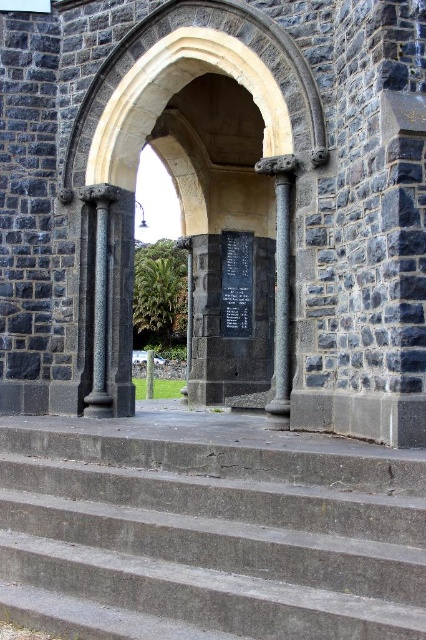
You are standing in front of the arched doorway and want to reach the black plaque mounted inside the archway. The gray concrete stairs at center are in your way. Can you move around them to access the plaque?

The gray concrete stairs at center are located at point [209,538], so you can move around them to access the plaque.

You are standing in front of the arched doorway and want to read the text on the black polished stone plaque at center. Which direction should you move to reach it from the gray concrete stairs at center?

The gray concrete stairs at center are below the black polished stone plaque at center, so you should move upward towards the plaque to reach it.